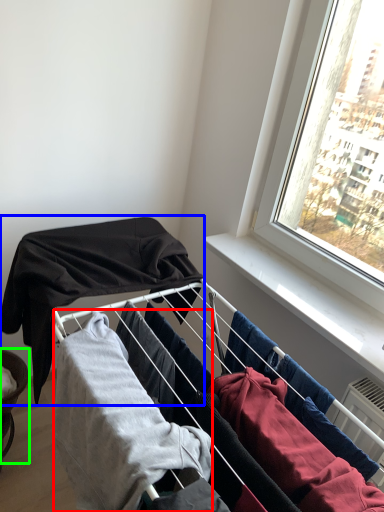
Question: Which is nearer to the clothing (highlighted by a red box)? clothing (highlighted by a blue box) or furniture (highlighted by a green box).

Choices:
 (A) clothing
 (B) furniture

Answer: (A)